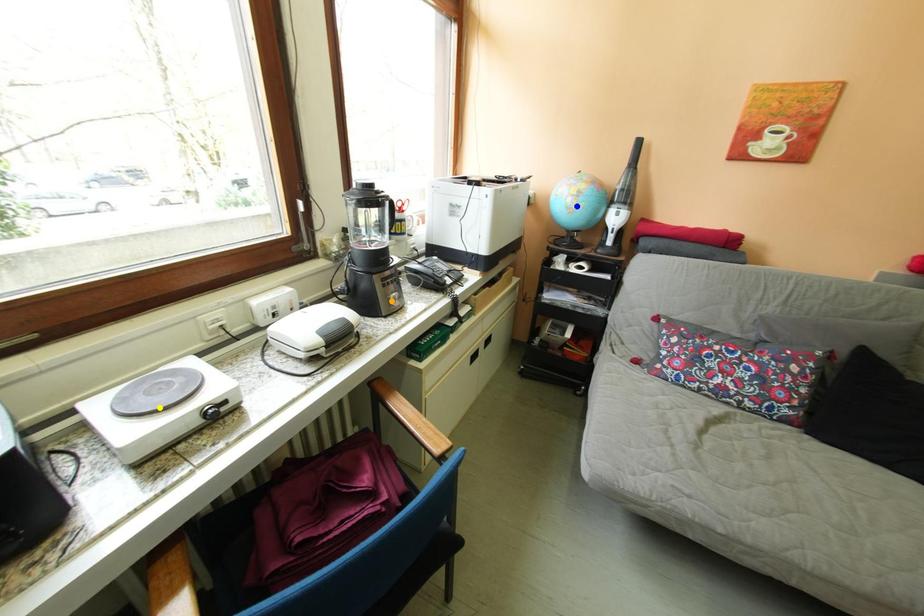
Order these from nearest to farthest:
- orange point
- yellow point
- blue point

yellow point
orange point
blue point